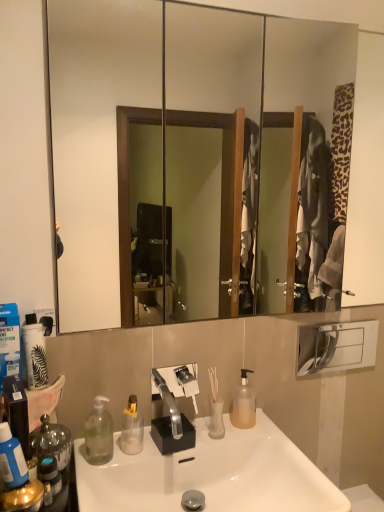
You are a GUI agent. You are given a task and a screenshot of the screen. Output one action in this format:
    pyautogui.click(x=<x>, y=<y>)
    Task: Click on the vacant region above clear glass mirror at upper center (from a real-world perspective)
    This screenshot has height=512, width=384.
    Given the screenshot: What is the action you would take?
    pyautogui.click(x=283, y=11)